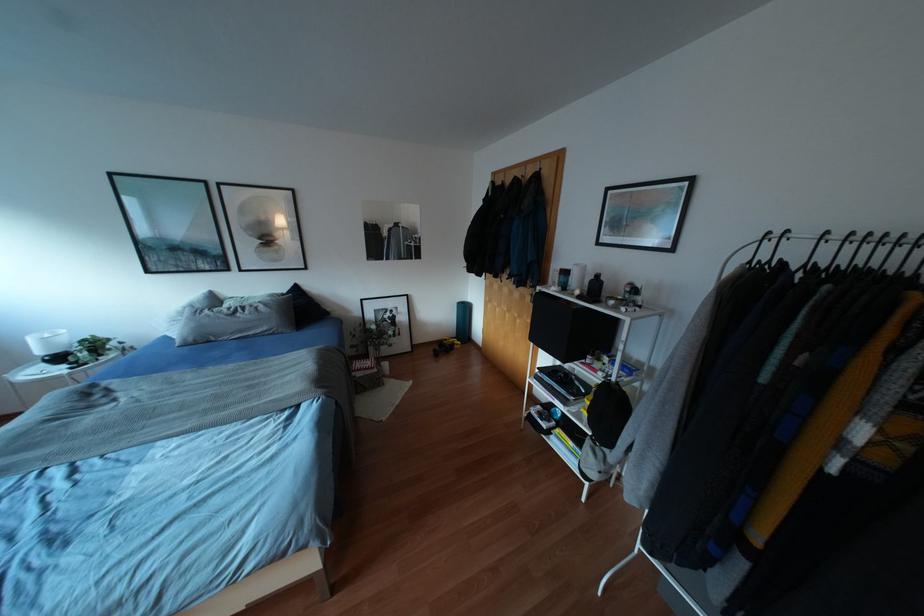
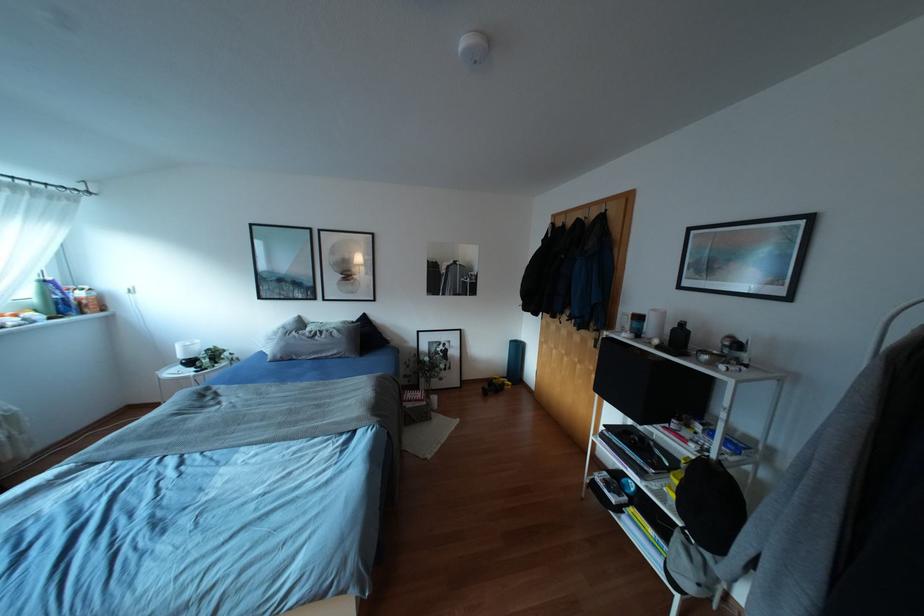
Question: Which direction would the cameraman need to move to produce the second image? Reply with the corresponding letter.

Choices:
 (A) Left
 (B) Right
 (C) Forward
 (D) Backward

Answer: (A)